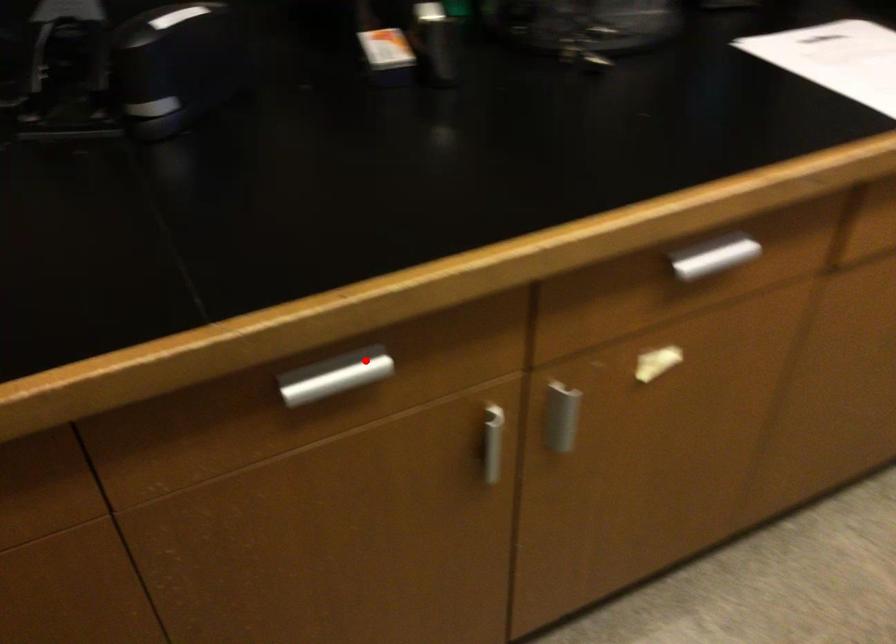
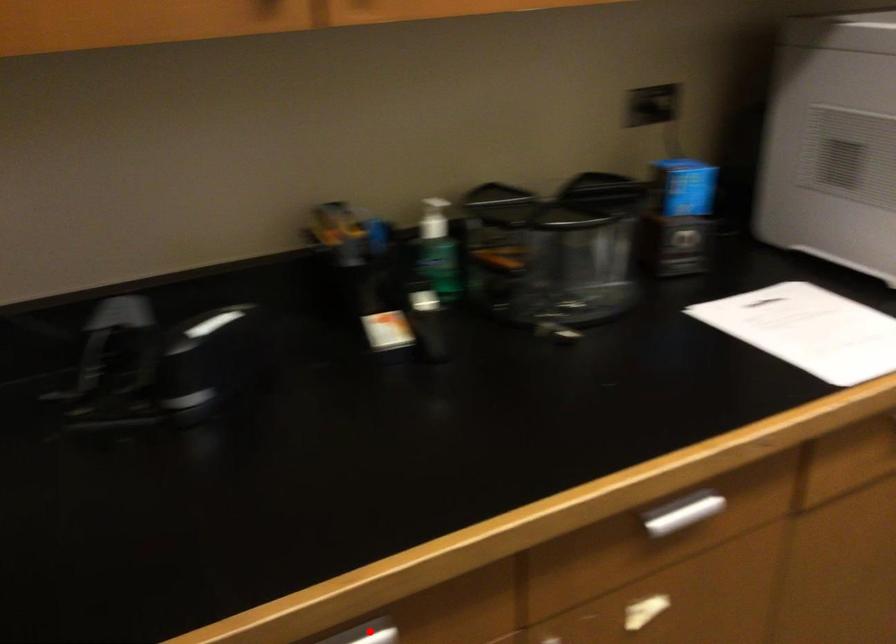
I am providing you with two images of the same scene from different viewpoints. A red point is marked on the first image and another point is marked on the second image. Is the marked point in image1 the same physical position as the marked point in image2?

Yes